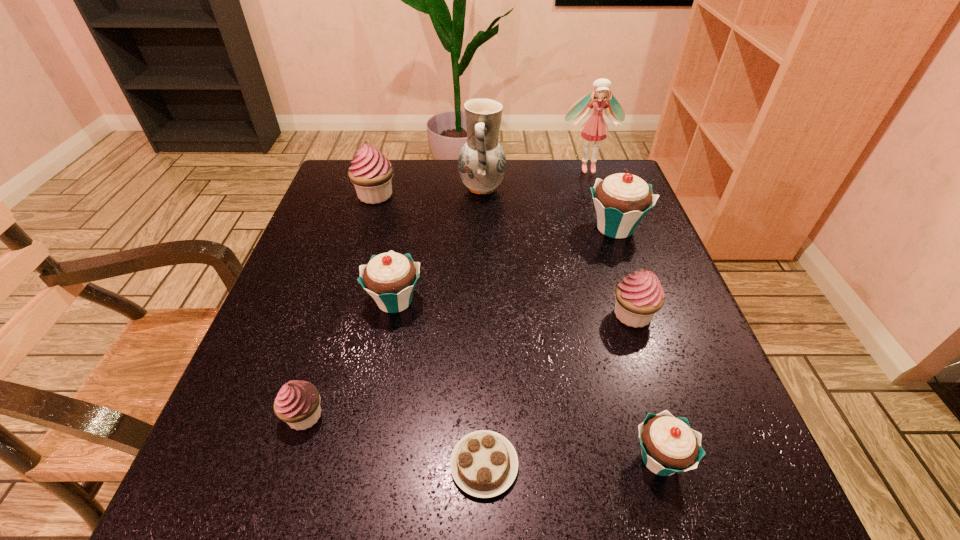
Locate an element on the screen. This screenshot has width=960, height=540. vacant area situated 0.060m on the front of the second biggest pink cupcake is located at coordinates (647, 360).

You are a GUI agent. You are given a task and a screenshot of the screen. Output one action in this format:
    pyautogui.click(x=<x>, y=<y>)
    Task: Click on the free space located on the right of the nearest pink cupcake
    This screenshot has height=540, width=960.
    Given the screenshot: What is the action you would take?
    (401, 416)

Where is `free space located on the left of the nearest teal cupcake`? free space located on the left of the nearest teal cupcake is located at coordinates (588, 459).

You are a GUI agent. You are given a task and a screenshot of the screen. Output one action in this format:
    pyautogui.click(x=<x>, y=<y>)
    Task: Click on the vacant region located 0.150m on the right of the shortest object
    The width and height of the screenshot is (960, 540).
    Given the screenshot: What is the action you would take?
    pyautogui.click(x=621, y=465)

The width and height of the screenshot is (960, 540). Identify the location of doll that is at the far edge. (595, 128).

The height and width of the screenshot is (540, 960). Identify the location of pottery present at the far edge. (482, 161).

Locate an element on the screen. This screenshot has width=960, height=540. cupcake that is at the far edge is located at coordinates (371, 172).

Image resolution: width=960 pixels, height=540 pixels. In order to click on cupcake that is at the near edge in this screenshot , I will do `click(669, 445)`.

You are a GUI agent. You are given a task and a screenshot of the screen. Output one action in this format:
    pyautogui.click(x=<x>, y=<y>)
    Task: Click on the chocolate cake situated at the near edge
    Image resolution: width=960 pixels, height=540 pixels.
    Given the screenshot: What is the action you would take?
    pyautogui.click(x=484, y=464)

Where is `doll situated at the right edge`? The image size is (960, 540). doll situated at the right edge is located at coordinates (595, 128).